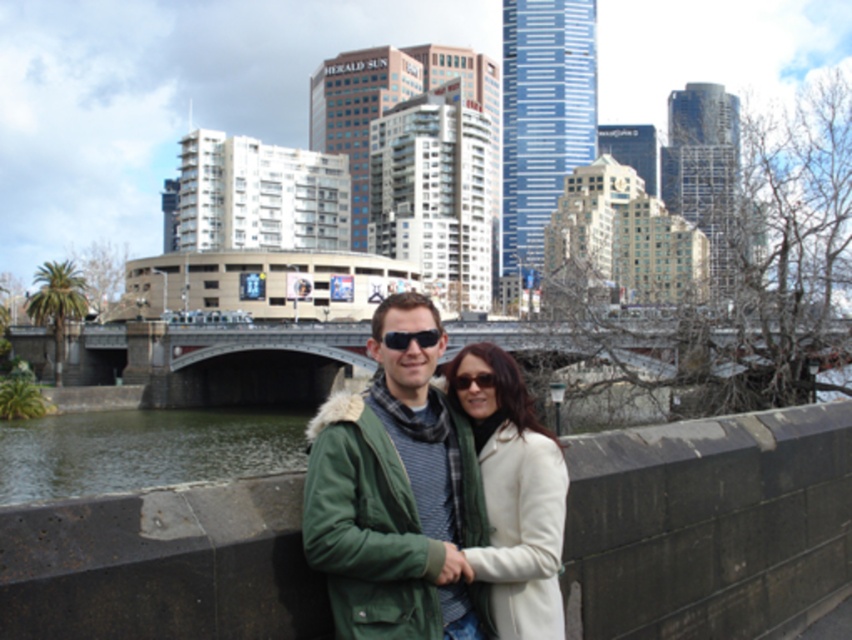
You are a photographer trying to frame a shot of the green fabric coat at center and the white wool coat at center. Which coat should you adjust your camera angle to focus on if you want to capture the wider one?

The green fabric coat at center might be wider than the white wool coat at center, so you should focus on the green fabric coat at center to capture the wider one.

You are a photographer trying to capture the couple on the stone bridge. The green water at lower left and the black plastic sunglasses at center are in your viewfinder. Which object appears taller in the photo?

The green water at lower left appears taller than the black plastic sunglasses at center in the photo because the green water at lower left has a greater height compared to the black plastic sunglasses at center.